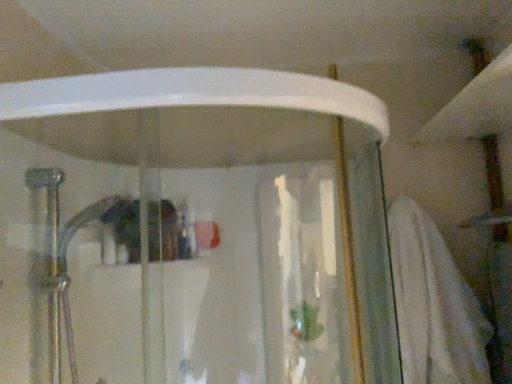
Question: Considering the positions of white soft towel at right and transparent glass shower door at center in the image, is white soft towel at right taller or shorter than transparent glass shower door at center?

Choices:
 (A) short
 (B) tall

Answer: (A)

Question: Looking at their shapes, would you say white soft towel at right is wider or thinner than transparent glass shower door at center?

Choices:
 (A) thin
 (B) wide

Answer: (A)

Question: Does point (425, 365) appear closer or farther from the camera than point (130, 306)?

Choices:
 (A) farther
 (B) closer

Answer: (A)

Question: Is transparent glass shower door at center wider or thinner than white soft towel at right?

Choices:
 (A) thin
 (B) wide

Answer: (B)

Question: Is point (385, 307) closer or farther from the camera than point (435, 337)?

Choices:
 (A) farther
 (B) closer

Answer: (A)

Question: Considering the relative positions of transparent glass shower door at center and white soft towel at right in the image provided, is transparent glass shower door at center to the left or to the right of white soft towel at right?

Choices:
 (A) left
 (B) right

Answer: (A)

Question: Looking at the image, does transparent glass shower door at center seem bigger or smaller compared to white soft towel at right?

Choices:
 (A) small
 (B) big

Answer: (B)